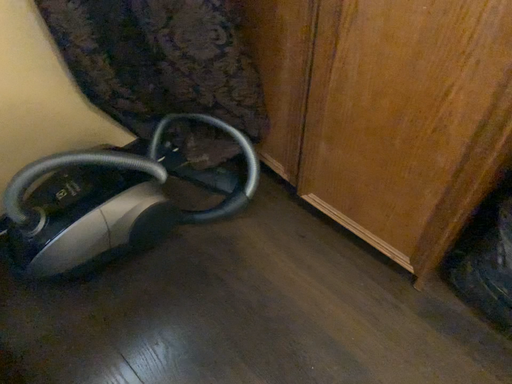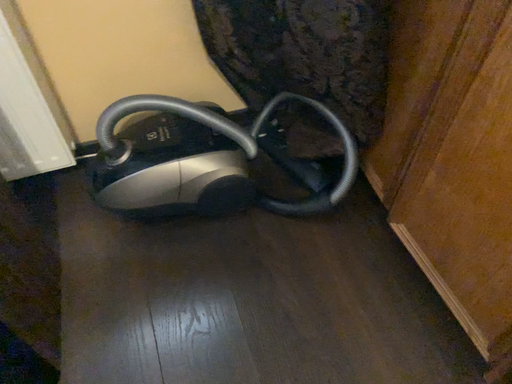
Question: Which way did the camera rotate in the video?

Choices:
 (A) rotated left
 (B) rotated right

Answer: (A)